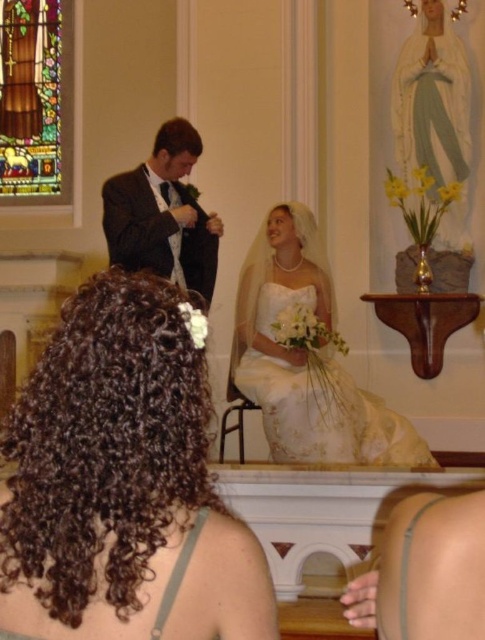
Question: Considering the real-world distances, which object is closest to the stained glass at upper left?

Choices:
 (A) dark curly hair at center
 (B) matte black suit at center

Answer: (B)

Question: Is dark curly hair at center smaller than stained glass at upper left?

Choices:
 (A) no
 (B) yes

Answer: (B)

Question: Is dark curly hair at center to the left of matte black suit at center from the viewer's perspective?

Choices:
 (A) no
 (B) yes

Answer: (A)

Question: Does stained glass at upper left appear on the left side of matte black suit at center?

Choices:
 (A) no
 (B) yes

Answer: (B)

Question: Which is farther from the matte black suit at center?

Choices:
 (A) dark curly hair at center
 (B) stained glass at upper left
 (C) white satin dress at center

Answer: (A)

Question: Which object is closer to the camera taking this photo?

Choices:
 (A) stained glass at upper left
 (B) matte black suit at center

Answer: (B)